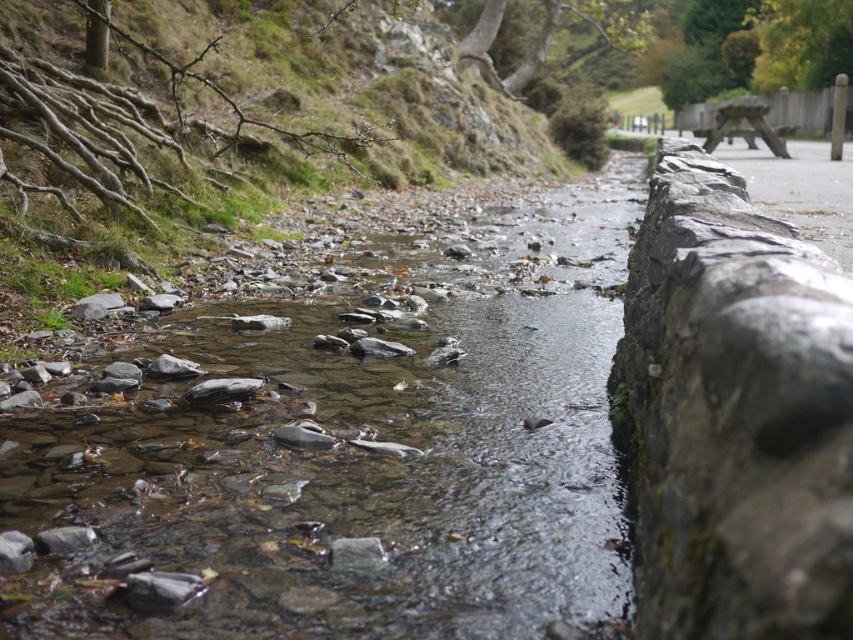
Does point (264, 636) come behind point (717, 154)?

That is False.

Describe the element at coordinates (357, 452) in the screenshot. The height and width of the screenshot is (640, 853). I see `clear water at center` at that location.

What do you see at coordinates (357, 452) in the screenshot?
I see `clear water at center` at bounding box center [357, 452].

Locate an element on the screen. clear water at center is located at coordinates (357, 452).